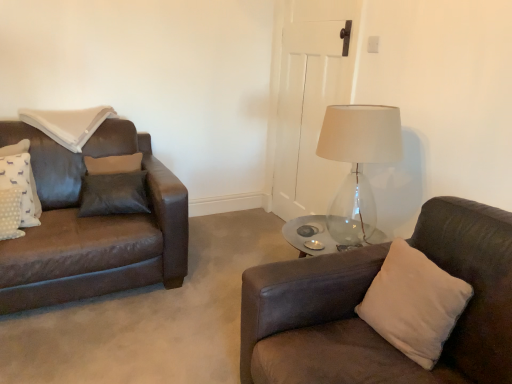
Question: Considering the relative sizes of beige suede pillow at right, which is the first pillow from bottom to top, and white fabric pillow at upper left, which is the second pillow in left-to-right order, in the image provided, is beige suede pillow at right, which is the first pillow from bottom to top, wider than white fabric pillow at upper left, which is the second pillow in left-to-right order,?

Choices:
 (A) no
 (B) yes

Answer: (A)

Question: From the image's perspective, is beige suede pillow at right, acting as the 1th pillow starting from the front, located beneath white fabric pillow at upper left, which is the second pillow in left-to-right order?

Choices:
 (A) yes
 (B) no

Answer: (A)

Question: Considering the relative positions of beige suede pillow at right, which is the first pillow from bottom to top, and white fabric pillow at upper left, which is the second pillow in left-to-right order, in the image provided, is beige suede pillow at right, which is the first pillow from bottom to top, to the right of white fabric pillow at upper left, which is the second pillow in left-to-right order, from the viewer's perspective?

Choices:
 (A) yes
 (B) no

Answer: (A)

Question: Is beige suede pillow at right, marked as the first pillow in a right-to-left arrangement, not inside white fabric pillow at upper left, which is the 2th pillow from right to left?

Choices:
 (A) no
 (B) yes

Answer: (B)

Question: Can you confirm if beige suede pillow at right, acting as the 1th pillow starting from the front, is positioned to the left of white fabric pillow at upper left, which is the second pillow in left-to-right order?

Choices:
 (A) yes
 (B) no

Answer: (B)

Question: Is beige suede pillow at right, marked as the first pillow in a right-to-left arrangement, shorter than white fabric pillow at upper left, placed as the first pillow when sorted from back to front?

Choices:
 (A) no
 (B) yes

Answer: (A)

Question: Is white fabric pillow at upper left, which is the second pillow in left-to-right order, inside white dotted fabric pillow at left, which ranks as the 2th pillow in back-to-front order?

Choices:
 (A) no
 (B) yes

Answer: (A)

Question: Can you confirm if white dotted fabric pillow at left, positioned as the second pillow in top-to-bottom order, is wider than white fabric pillow at upper left, placed as the first pillow when sorted from back to front?

Choices:
 (A) yes
 (B) no

Answer: (B)

Question: Is the depth of white dotted fabric pillow at left, placed as the second pillow when sorted from front to back, greater than that of white fabric pillow at upper left, the 3th pillow viewed from the front?

Choices:
 (A) yes
 (B) no

Answer: (B)

Question: Are white dotted fabric pillow at left, positioned as the second pillow in top-to-bottom order, and white fabric pillow at upper left, which is the second pillow in left-to-right order, located far from each other?

Choices:
 (A) yes
 (B) no

Answer: (B)

Question: From the image's perspective, is white dotted fabric pillow at left, which ranks as the 2th pillow in back-to-front order, under white fabric pillow at upper left, placed as the first pillow when sorted from back to front?

Choices:
 (A) yes
 (B) no

Answer: (A)

Question: Is white dotted fabric pillow at left, acting as the 1th pillow starting from the left, smaller than white fabric pillow at upper left, which is the 2th pillow from right to left?

Choices:
 (A) yes
 (B) no

Answer: (A)

Question: From a real-world perspective, is white fabric pillow at upper left, which is the 2th pillow from right to left, located higher than white dotted fabric pillow at left, acting as the 1th pillow starting from the left?

Choices:
 (A) no
 (B) yes

Answer: (B)